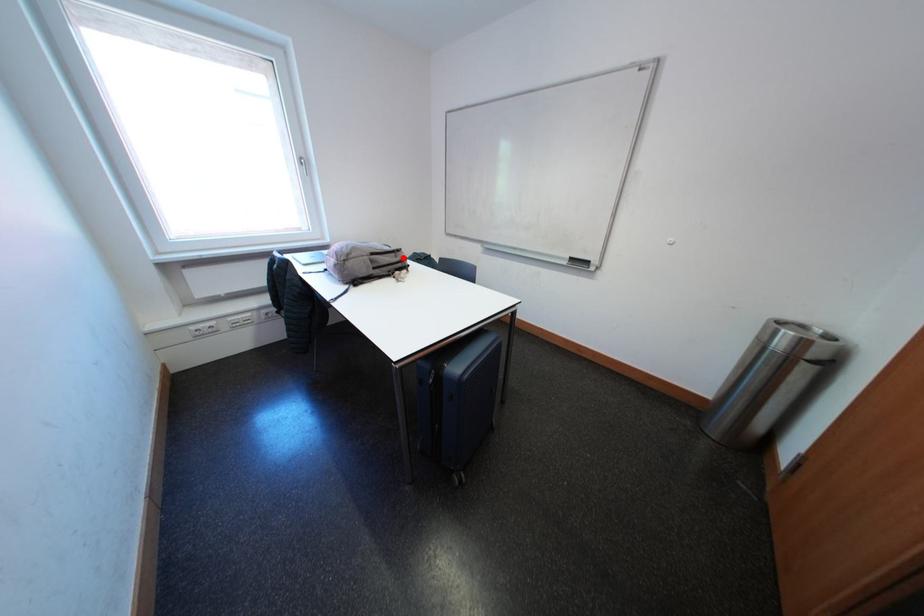
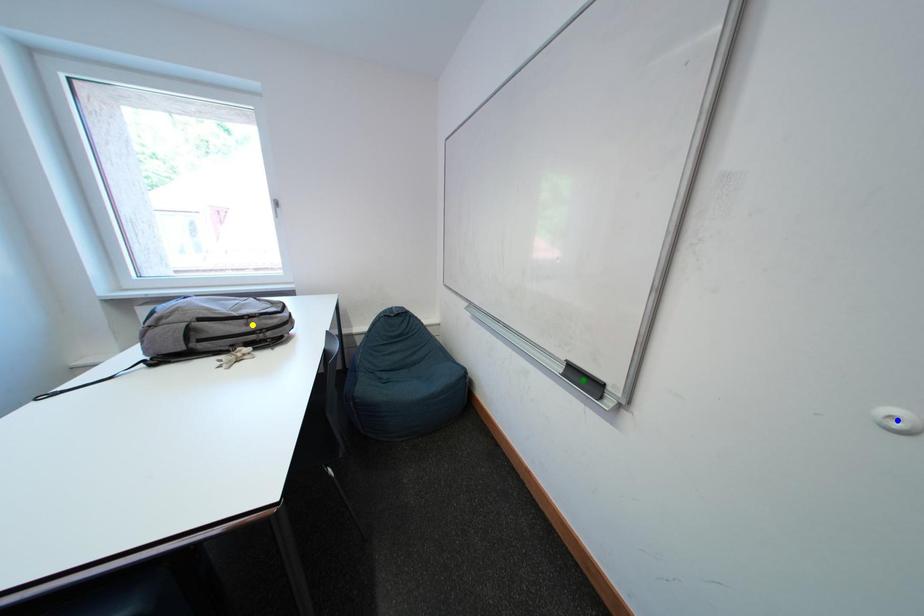
Question: I am providing you with two images of the same scene from different viewpoints. A red point is marked on the first image. You are given multiple points on the second image. In image 2, which mark is for the same physical point as the one in image 1?

Choices:
 (A) blue point
 (B) yellow point
 (C) green point

Answer: (B)